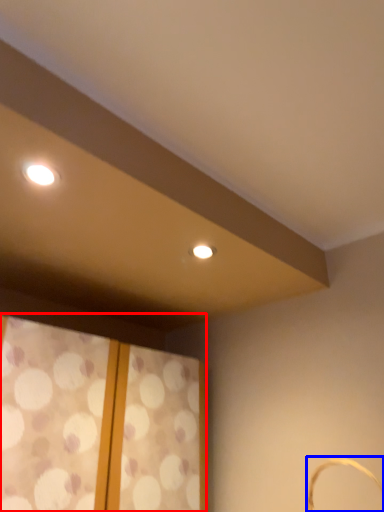
Question: Which object is further to the camera taking this photo, window (highlighted by a red box) or basket (highlighted by a blue box)?

Choices:
 (A) window
 (B) basket

Answer: (A)